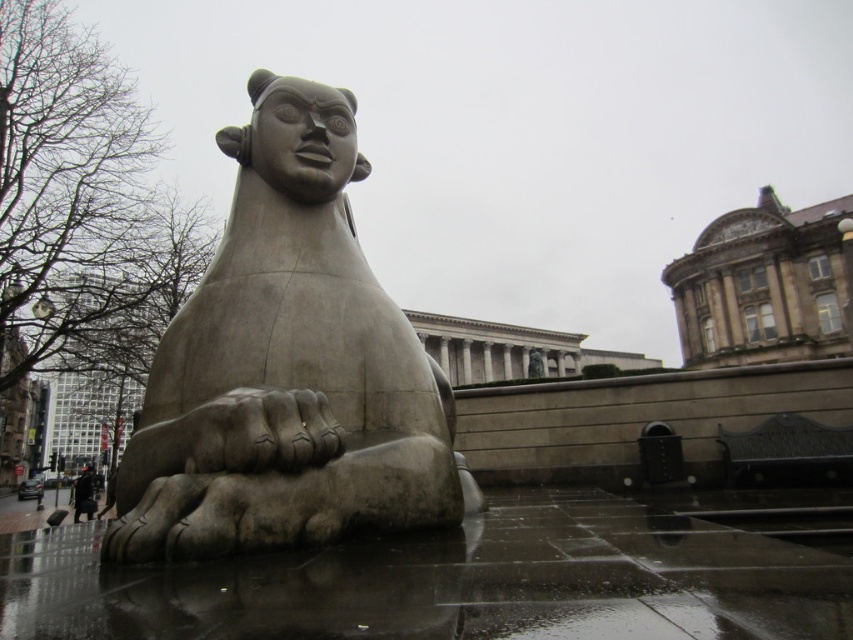
Measure the distance from gray stone sculpture at center to dark brown leather coat at lower left.

gray stone sculpture at center is 128.55 feet away from dark brown leather coat at lower left.

Is point (381, 456) positioned after point (83, 483)?

No, it is in front of (83, 483).

Who is more forward, (265, 163) or (91, 477)?

Positioned in front is point (265, 163).

Locate an element on the screen. Image resolution: width=853 pixels, height=640 pixels. gray stone sculpture at center is located at coordinates (288, 369).